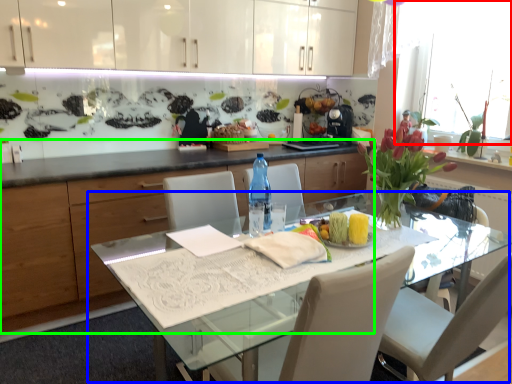
Question: Which object is positioned closest to window screen (highlighted by a red box)? Select from kitchen & dining room table (highlighted by a blue box) and cabinetry (highlighted by a green box).

Choices:
 (A) kitchen & dining room table
 (B) cabinetry

Answer: (A)